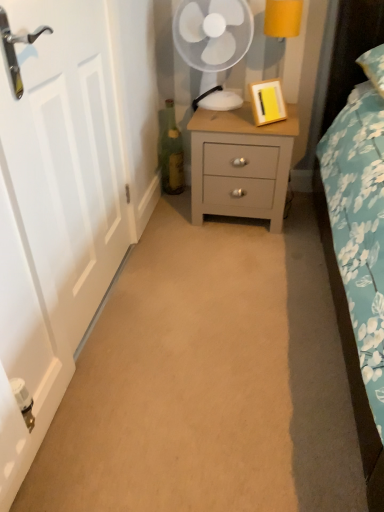
This screenshot has width=384, height=512. Find the location of `free space in front of white matte door at left`. free space in front of white matte door at left is located at coordinates (144, 379).